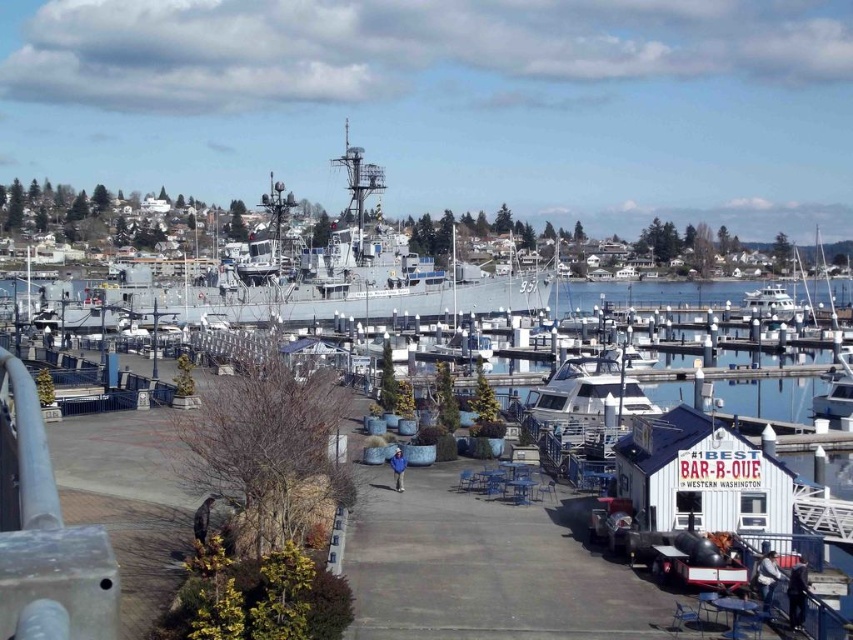
How much distance is there between gray metallic ship at center and white glossy yacht at right?

They are 48.53 meters apart.

Is point (531, 308) farther from viewer compared to point (759, 316)?

No, (531, 308) is in front of (759, 316).

Who is more forward, (x=350, y=148) or (x=787, y=307)?

Point (x=350, y=148)

Find the location of a particular element. gray metallic ship at center is located at coordinates (351, 285).

Does gray metallic ship at center come in front of white glossy boat at center?

No, gray metallic ship at center is further to the viewer.

Does point (343, 154) come farther from viewer compared to point (595, 417)?

Yes, point (343, 154) is farther from viewer.

This screenshot has height=640, width=853. Find the location of `gray metallic ship at center`. gray metallic ship at center is located at coordinates (351, 285).

Does white glossy boat at center appear on the left side of white glossy yacht at right?

Yes, white glossy boat at center is to the left of white glossy yacht at right.

Measure the distance between white glossy boat at center and white glossy yacht at right.

The distance of white glossy boat at center from white glossy yacht at right is 81.95 meters.

This screenshot has width=853, height=640. What are the coordinates of `white glossy boat at center` in the screenshot? It's located at (585, 403).